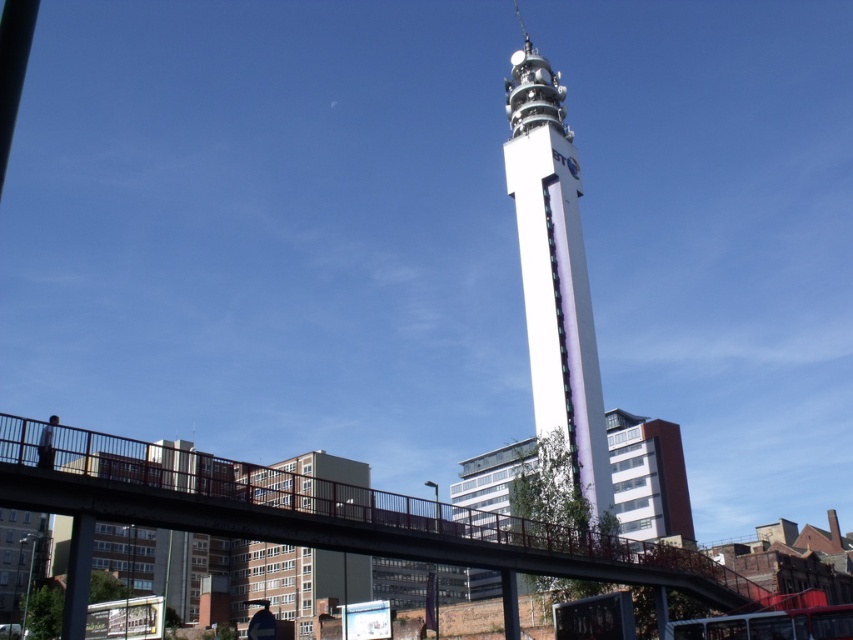
Is point (535, 58) farther from viewer compared to point (39, 451)?

Yes.

What do you see at coordinates (555, 272) in the screenshot?
I see `white smooth tower at center` at bounding box center [555, 272].

This screenshot has height=640, width=853. I want to click on white smooth tower at center, so click(555, 272).